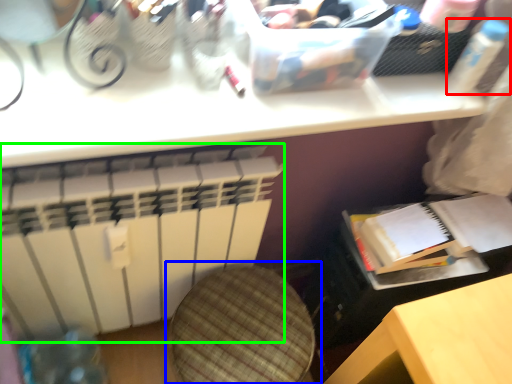
Question: Which object is the farthest from bottle (highlighted by a red box)? Choose among these: swivel chair (highlighted by a blue box) or radiator (highlighted by a green box).

Choices:
 (A) swivel chair
 (B) radiator

Answer: (B)